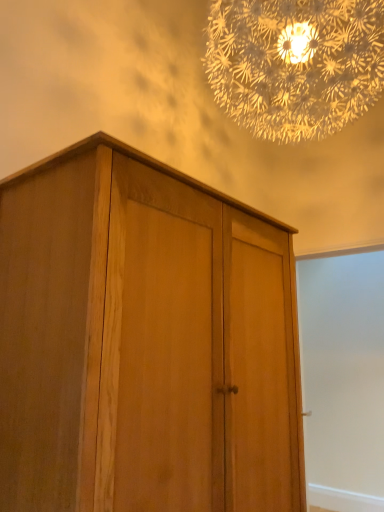
Question: Can you confirm if natural wood cupboard at center is shorter than translucent glass chandelier at upper center?

Choices:
 (A) yes
 (B) no

Answer: (A)

Question: Does natural wood cupboard at center have a greater width compared to translucent glass chandelier at upper center?

Choices:
 (A) no
 (B) yes

Answer: (A)

Question: Considering the relative sizes of natural wood cupboard at center and translucent glass chandelier at upper center in the image provided, is natural wood cupboard at center smaller than translucent glass chandelier at upper center?

Choices:
 (A) yes
 (B) no

Answer: (A)

Question: Is natural wood cupboard at center positioned far away from translucent glass chandelier at upper center?

Choices:
 (A) no
 (B) yes

Answer: (A)

Question: Is natural wood cupboard at center bigger than translucent glass chandelier at upper center?

Choices:
 (A) yes
 (B) no

Answer: (B)

Question: From the image's perspective, is natural wood cupboard at center above or below white matte screen door at right?

Choices:
 (A) below
 (B) above

Answer: (B)

Question: In terms of size, does natural wood cupboard at center appear bigger or smaller than white matte screen door at right?

Choices:
 (A) big
 (B) small

Answer: (A)

Question: From a real-world perspective, is natural wood cupboard at center positioned above or below white matte screen door at right?

Choices:
 (A) below
 (B) above

Answer: (B)

Question: Which is correct: natural wood cupboard at center is inside white matte screen door at right, or outside of it?

Choices:
 (A) outside
 (B) inside

Answer: (A)

Question: From the image's perspective, is translucent glass chandelier at upper center located above or below white matte screen door at right?

Choices:
 (A) below
 (B) above

Answer: (B)

Question: From their relative heights in the image, would you say translucent glass chandelier at upper center is taller or shorter than white matte screen door at right?

Choices:
 (A) tall
 (B) short

Answer: (B)

Question: Is translucent glass chandelier at upper center situated inside white matte screen door at right or outside?

Choices:
 (A) inside
 (B) outside

Answer: (B)

Question: From a real-world perspective, is translucent glass chandelier at upper center positioned above or below white matte screen door at right?

Choices:
 (A) below
 (B) above

Answer: (B)

Question: Looking at the image, does white matte screen door at right seem bigger or smaller compared to natural wood cupboard at center?

Choices:
 (A) small
 (B) big

Answer: (A)

Question: Is white matte screen door at right inside the boundaries of natural wood cupboard at center, or outside?

Choices:
 (A) outside
 (B) inside

Answer: (A)